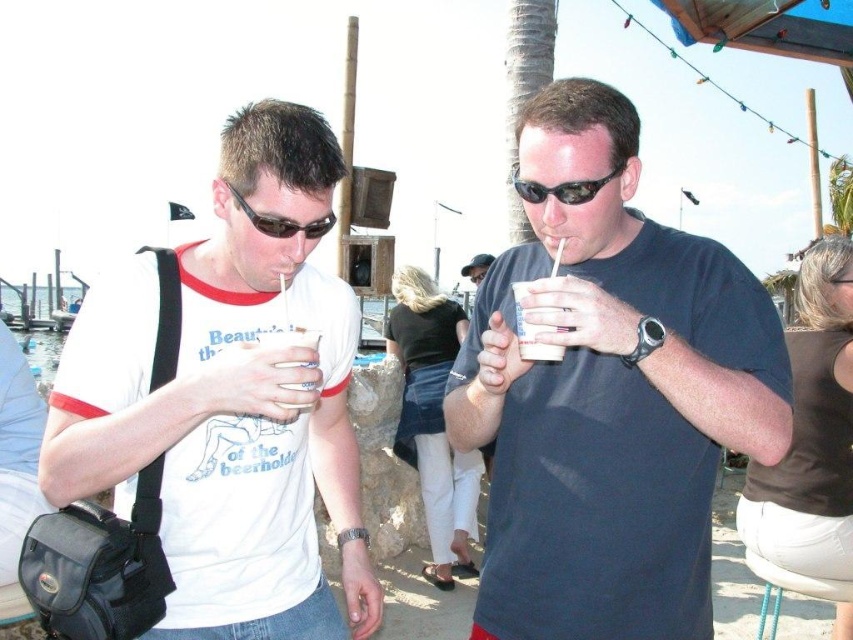
You are standing at the origin of the coordinate system in the image. You want to walk to the point labeled as point (345, 344). However, there is an obstacle at point (519, 192). Can you reach your destination without passing through the obstacle?

Since point (345, 344) is behind point (519, 192), you can reach the destination by going around the obstacle at point (519, 192) without passing through it.